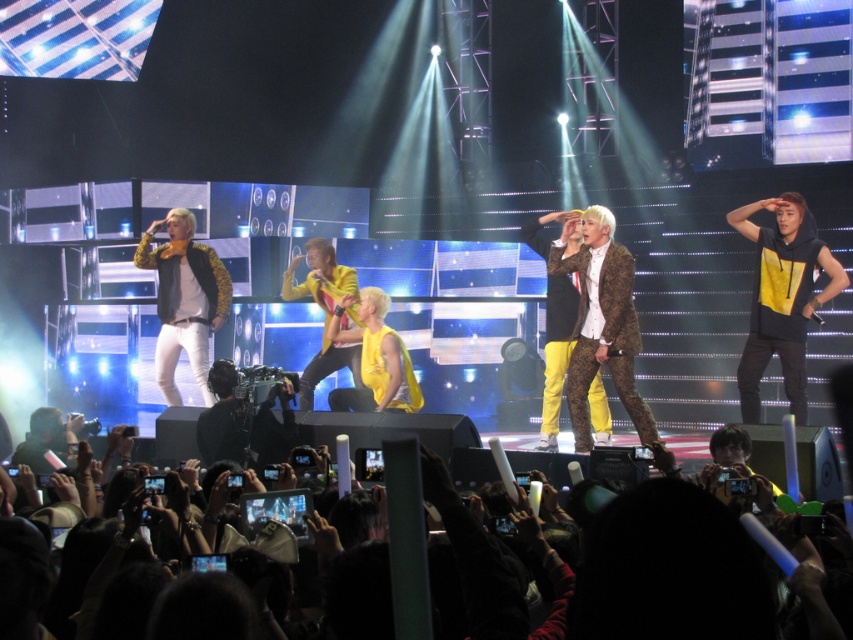
Does yellow matte hoodie at right appear over black fabric crowd at lower center?

Correct, yellow matte hoodie at right is located above black fabric crowd at lower center.

Does point (780, 243) lie behind point (672, 548)?

That is True.

The height and width of the screenshot is (640, 853). Identify the location of yellow matte hoodie at right. (782, 298).

In order to click on yellow matte hoodie at right in this screenshot , I will do `click(782, 298)`.

Consider the image. Between yellow matte hoodie at right and leopard print jacket at left, which one has more height?

yellow matte hoodie at right

Is yellow matte hoodie at right positioned before leopard print jacket at left?

Yes.

Which is behind, point (807, 269) or point (160, 353)?

The point (160, 353) is more distant.

Locate an element on the screen. Image resolution: width=853 pixels, height=640 pixels. yellow matte hoodie at right is located at coordinates (782, 298).

Does black fabric crowd at lower center have a lesser height compared to leopard print jacket at left?

Yes, black fabric crowd at lower center is shorter than leopard print jacket at left.

Measure the distance between point (425, 490) and camera.

Point (425, 490) is 2.90 meters from camera.

In order to click on black fabric crowd at lower center in this screenshot , I will do `click(437, 490)`.